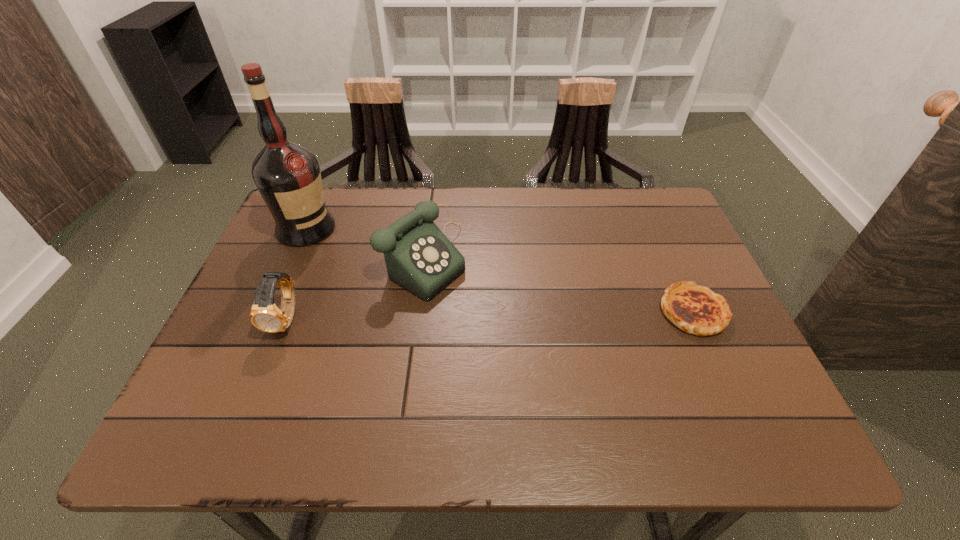
The image size is (960, 540). Identify the location of the second shortest object. (265, 315).

Find the location of a particular element. The image size is (960, 540). the rightmost object is located at coordinates (695, 309).

What are the coordinates of `the shortest object` in the screenshot? It's located at (695, 309).

Where is `the tallest object`? the tallest object is located at coordinates (288, 177).

Find the location of a particular element. Image resolution: width=960 pixels, height=540 pixels. the third object from left to right is located at coordinates (418, 256).

You are a GUI agent. You are given a task and a screenshot of the screen. Output one action in this format:
    pyautogui.click(x=<x>, y=<y>)
    Task: Click on the third shortest object
    This screenshot has width=960, height=540.
    Given the screenshot: What is the action you would take?
    pyautogui.click(x=418, y=256)

Find the location of a particular element. This screenshot has height=540, width=960. vacant region located 0.130m on the face of the second shortest object is located at coordinates pyautogui.click(x=257, y=394).

This screenshot has width=960, height=540. Find the location of `vacant space situated on the left of the shortest object`. vacant space situated on the left of the shortest object is located at coordinates (630, 312).

The width and height of the screenshot is (960, 540). Find the location of `free space located 0.100m on the surface of the tallest object`. free space located 0.100m on the surface of the tallest object is located at coordinates (349, 254).

The width and height of the screenshot is (960, 540). I want to click on vacant space located on the surface of the tallest object, so click(355, 258).